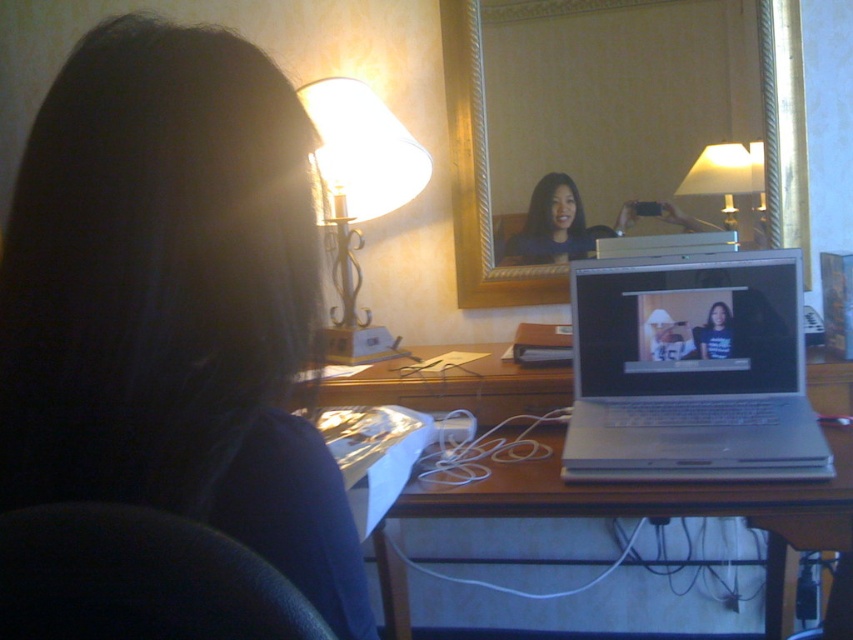
You are a delivery robot with a 12 inch wide package. You need to place the package between the dark blue fabric at upper left and the black leather chair at lower left. Is there enough space?

The dark blue fabric at upper left and black leather chair at lower left are 7.70 inches apart. Since the package is 12 inches wide, there isn t enough space to place it between them.

You are standing in the hotel room and want to take a photo of the two points mentioned. Which point, point [785,458] or point [71,632], is closer to the camera and should be in focus first?

Point [785,458] is further to the camera than point [71,632], so the point closer to the camera is point [71,632] and should be in focus first.

You are a delivery robot that needs to place a small package on the desk without hitting the silver metallic laptop at center or the black leather chair at lower left. Considering their heights, which object should you avoid placing the package near to ensure it doesn

The silver metallic laptop at center is much taller than the black leather chair at lower left, so you should avoid placing the package near the silver metallic laptop at center to prevent it from being knocked over.